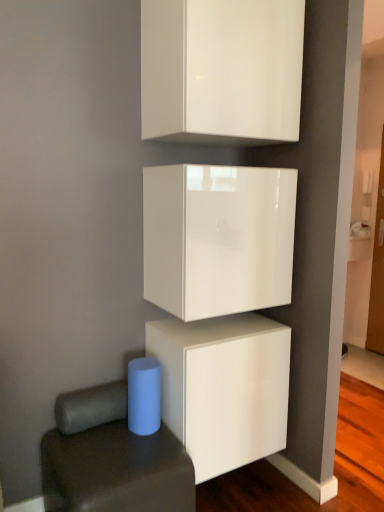
Question: Which direction should I rotate to look at white glossy cabinet at upper center, which is the first cabinetry in top-to-bottom order?

Choices:
 (A) right
 (B) left

Answer: (A)

Question: Does white glossy cabinet at lower center, the 1th cabinetry positioned from the bottom, have a greater height compared to blue matte cylinder at lower left?

Choices:
 (A) no
 (B) yes

Answer: (B)

Question: Considering the relative sizes of white glossy cabinet at lower center, the third cabinetry in the top-to-bottom sequence, and blue matte cylinder at lower left in the image provided, is white glossy cabinet at lower center, the third cabinetry in the top-to-bottom sequence, wider than blue matte cylinder at lower left?

Choices:
 (A) no
 (B) yes

Answer: (A)

Question: Is blue matte cylinder at lower left completely or partially inside white glossy cabinet at lower center, the 1th cabinetry positioned from the bottom?

Choices:
 (A) no
 (B) yes

Answer: (A)

Question: Is white glossy cabinet at lower center, the 1th cabinetry positioned from the bottom, shorter than blue matte cylinder at lower left?

Choices:
 (A) no
 (B) yes

Answer: (A)

Question: Is white glossy cabinet at lower center, the 1th cabinetry positioned from the bottom, in contact with blue matte cylinder at lower left?

Choices:
 (A) no
 (B) yes

Answer: (A)

Question: Does white glossy cabinet at lower center, the third cabinetry in the top-to-bottom sequence, come in front of blue matte cylinder at lower left?

Choices:
 (A) no
 (B) yes

Answer: (A)

Question: Is white glossy cabinet at lower center, the 1th cabinetry positioned from the bottom, outside white glossy cabinet at upper center, which is the first cabinetry in top-to-bottom order?

Choices:
 (A) no
 (B) yes

Answer: (B)

Question: Is white glossy cabinet at lower center, the 1th cabinetry positioned from the bottom, shorter than white glossy cabinet at upper center, the third cabinetry from the bottom?

Choices:
 (A) yes
 (B) no

Answer: (A)

Question: Can you confirm if white glossy cabinet at lower center, the third cabinetry in the top-to-bottom sequence, is thinner than white glossy cabinet at upper center, the third cabinetry from the bottom?

Choices:
 (A) no
 (B) yes

Answer: (A)

Question: From the image's perspective, is white glossy cabinet at lower center, the 1th cabinetry positioned from the bottom, located beneath white glossy cabinet at upper center, the third cabinetry from the bottom?

Choices:
 (A) yes
 (B) no

Answer: (A)

Question: Is white glossy cabinet at lower center, the third cabinetry in the top-to-bottom sequence, touching white glossy cabinet at upper center, the third cabinetry from the bottom?

Choices:
 (A) yes
 (B) no

Answer: (B)

Question: Could you tell me if white glossy cabinet at lower center, the third cabinetry in the top-to-bottom sequence, is turned towards white glossy cabinet at upper center, the third cabinetry from the bottom?

Choices:
 (A) no
 (B) yes

Answer: (A)

Question: Is blue matte cylinder at lower left next to white glossy cabinet at lower center, the 1th cabinetry positioned from the bottom?

Choices:
 (A) yes
 (B) no

Answer: (B)